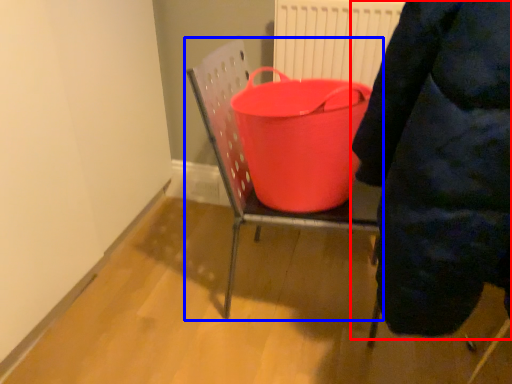
Question: Which object is further to the camera taking this photo, person (highlighted by a red box) or furniture (highlighted by a blue box)?

Choices:
 (A) person
 (B) furniture

Answer: (B)